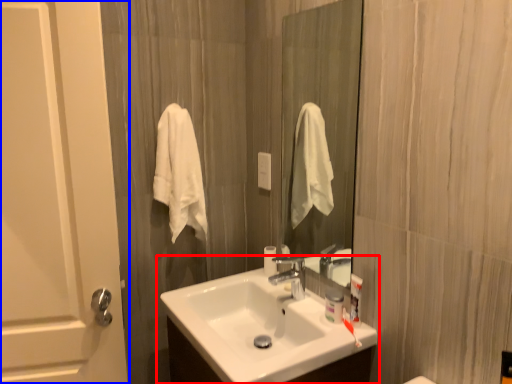
Question: Which object is closer to the camera taking this photo, sink (highlighted by a red box) or door (highlighted by a blue box)?

Choices:
 (A) sink
 (B) door

Answer: (A)